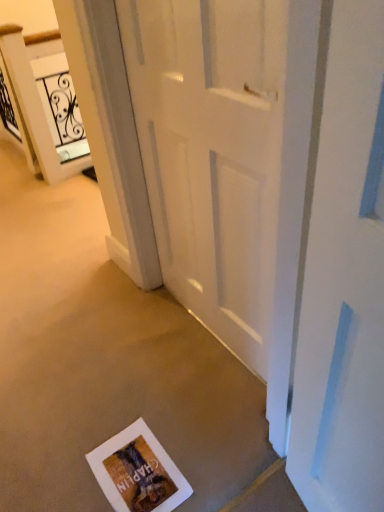
Describe the element at coordinates (212, 153) in the screenshot. I see `white matte door at center` at that location.

What do you see at coordinates (138, 472) in the screenshot? I see `matte paper postcard at lower center` at bounding box center [138, 472].

This screenshot has width=384, height=512. What are the coordinates of `white glossy elevator at upper left` in the screenshot? It's located at (42, 104).

Looking at this image, can you confirm if white glossy elevator at upper left is shorter than matte paper postcard at lower center?

In fact, white glossy elevator at upper left may be taller than matte paper postcard at lower center.

Is white glossy elevator at upper left positioned far away from matte paper postcard at lower center?

That's right, there is a large distance between white glossy elevator at upper left and matte paper postcard at lower center.

Find the location of a particular element. elevator lying above the matte paper postcard at lower center (from the image's perspective) is located at coordinates (42, 104).

How different are the orientations of white glossy elevator at upper left and matte paper postcard at lower center in degrees?

0.00155 degrees.

From a real-world perspective, which object rests below the other?

matte paper postcard at lower center, from a real-world perspective.

Does matte paper postcard at lower center touch white glossy elevator at upper left?

No, matte paper postcard at lower center is not making contact with white glossy elevator at upper left.

From the image's perspective, is matte paper postcard at lower center under white glossy elevator at upper left?

Yes, from the image's perspective, matte paper postcard at lower center is beneath white glossy elevator at upper left.

Is matte paper postcard at lower center positioned far away from white matte door at center?

No.

How far apart are matte paper postcard at lower center and white matte door at center?

matte paper postcard at lower center and white matte door at center are 29.18 inches apart.

Is white matte door at center a part of matte paper postcard at lower center?

Definitely not — white matte door at center is not inside matte paper postcard at lower center.

Does point (133, 431) lie in front of point (225, 328)?

Yes, it is in front of point (225, 328).

Is white matte door at center at the right side of white glossy elevator at upper left?

Indeed, white matte door at center is positioned on the right side of white glossy elevator at upper left.

Does white matte door at center touch white glossy elevator at upper left?

They are not placed beside each other.

In the scene shown: Is white matte door at center looking in the opposite direction of white glossy elevator at upper left?

white matte door at center is not turned away from white glossy elevator at upper left.

Which of these two, white matte door at center or matte paper postcard at lower center, stands taller?

white matte door at center is taller.

Considering the relative sizes of white matte door at center and matte paper postcard at lower center in the image provided, is white matte door at center thinner than matte paper postcard at lower center?

Indeed, white matte door at center has a lesser width compared to matte paper postcard at lower center.

Where is `door above the matte paper postcard at lower center (from a real-world perspective)`? Image resolution: width=384 pixels, height=512 pixels. door above the matte paper postcard at lower center (from a real-world perspective) is located at coordinates (212, 153).

Is white glossy elevator at upper left located outside white matte door at center?

Absolutely, white glossy elevator at upper left is external to white matte door at center.

Locate an element on the screen. elevator lying on the left of white matte door at center is located at coordinates (42, 104).

From the picture: Is white glossy elevator at upper left not near white matte door at center?

Yes, white glossy elevator at upper left is far from white matte door at center.

From a real-world perspective, between white glossy elevator at upper left and white matte door at center, who is vertically higher?

white matte door at center is physically above.

Identify the location of elevator above the matte paper postcard at lower center (from a real-world perspective). (42, 104).

At what (x,y) coordinates should I click in order to perform the action: click on elevator that is on the left side of matte paper postcard at lower center. Please return your answer as a coordinate pair (x, y). This screenshot has width=384, height=512. Looking at the image, I should click on pyautogui.click(x=42, y=104).

When comparing their distances from white matte door at center, does white glossy elevator at upper left or matte paper postcard at lower center seem closer?

matte paper postcard at lower center is closer to white matte door at center.

Which object lies further to the anchor point matte paper postcard at lower center, white matte door at center or white glossy elevator at upper left?

Based on the image, white glossy elevator at upper left appears to be further to matte paper postcard at lower center.

Based on their spatial positions, is matte paper postcard at lower center or white glossy elevator at upper left closer to white matte door at center?

matte paper postcard at lower center.

From the image, which object appears to be farther from white glossy elevator at upper left, matte paper postcard at lower center or white matte door at center?

matte paper postcard at lower center is positioned further to the anchor white glossy elevator at upper left.

Which object lies further to the anchor point matte paper postcard at lower center, white glossy elevator at upper left or white matte door at center?

white glossy elevator at upper left lies further to matte paper postcard at lower center than the other object.

Looking at the image, which one is located closer to white glossy elevator at upper left, white matte door at center or matte paper postcard at lower center?

white matte door at center is closer to white glossy elevator at upper left.

This screenshot has height=512, width=384. In order to click on door between white glossy elevator at upper left and matte paper postcard at lower center from top to bottom in this screenshot , I will do `click(212, 153)`.